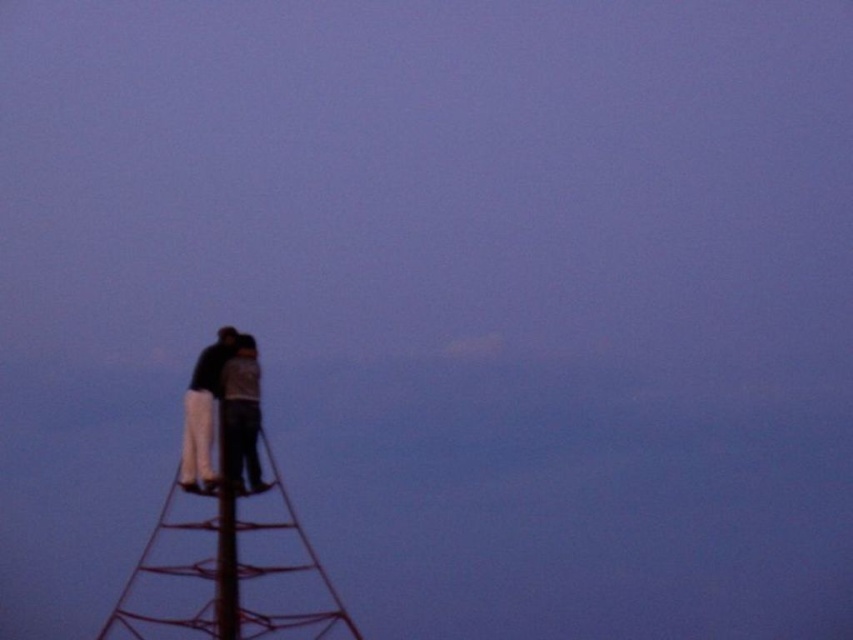
Is metallic red ladder at upper left wider than metallic red ladder at left?

Indeed, metallic red ladder at upper left has a greater width compared to metallic red ladder at left.

Is point (282, 598) less distant than point (219, 490)?

That is True.

Where is `metallic red ladder at upper left`? This screenshot has height=640, width=853. metallic red ladder at upper left is located at coordinates (229, 572).

This screenshot has width=853, height=640. What do you see at coordinates (229, 572) in the screenshot?
I see `metallic red ladder at upper left` at bounding box center [229, 572].

Identify the location of metallic red ladder at upper left. The image size is (853, 640). (229, 572).

Between dark gray fabric couple at upper left and metallic red ladder at left, which one is positioned higher?

dark gray fabric couple at upper left

Is dark gray fabric couple at upper left to the right of metallic red ladder at left from the viewer's perspective?

Yes, dark gray fabric couple at upper left is to the right of metallic red ladder at left.

Where is `dark gray fabric couple at upper left`? The height and width of the screenshot is (640, 853). dark gray fabric couple at upper left is located at coordinates (224, 413).

At what (x,y) coordinates should I click in order to perform the action: click on dark gray fabric couple at upper left. Please return your answer as a coordinate pair (x, y). Looking at the image, I should click on (224, 413).